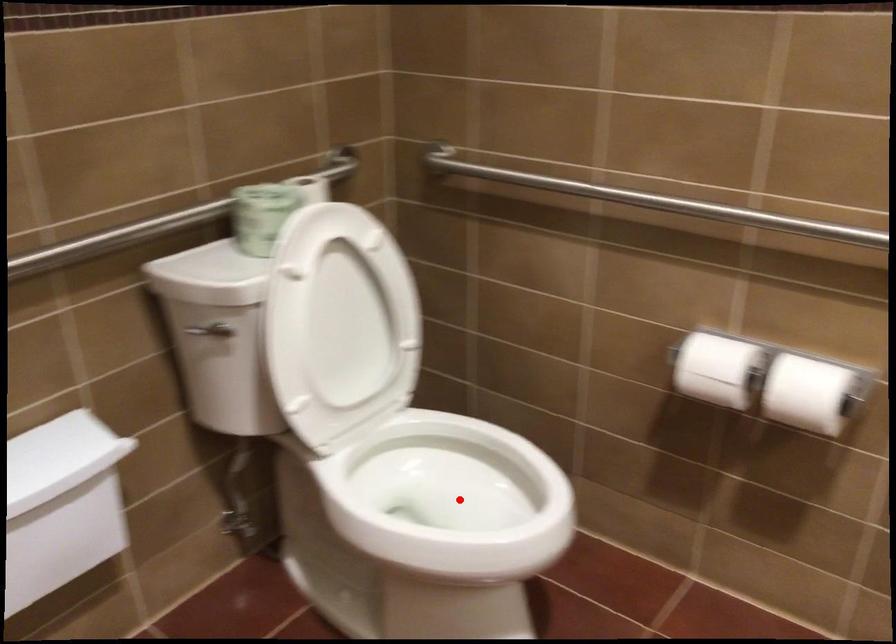
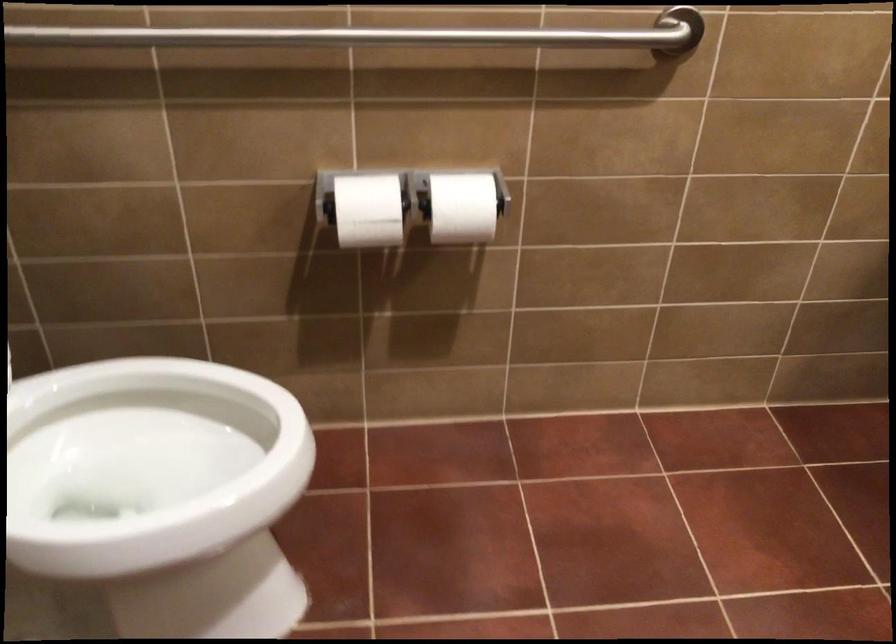
Where in the second image is the point corresponding to the highlighted location from the first image?

(147, 464)